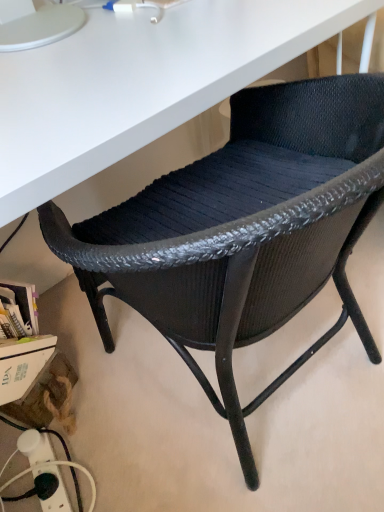
Where is `black woven chair at center`? black woven chair at center is located at coordinates (243, 231).

Describe the element at coordinates (243, 231) in the screenshot. The height and width of the screenshot is (512, 384). I see `black woven chair at center` at that location.

What do you see at coordinates (52, 490) in the screenshot? This screenshot has width=384, height=512. I see `black plastic power strip at lower left` at bounding box center [52, 490].

The image size is (384, 512). I want to click on black plastic power strip at lower left, so click(52, 490).

Find the location of a particular element. black woven chair at center is located at coordinates (243, 231).

Does black plastic power strip at lower left appear on the right side of black woven chair at center?

No.

Is black plastic power strip at lower left in front of or behind black woven chair at center in the image?

Visually, black plastic power strip at lower left is located behind black woven chair at center.

Which is in front, point (52, 506) or point (309, 155)?

Point (309, 155)

From the image's perspective, which one is positioned lower, black plastic power strip at lower left or black woven chair at center?

black plastic power strip at lower left.

From a real-world perspective, which is physically above, black plastic power strip at lower left or black woven chair at center?

black woven chair at center.

Which object is wider, black plastic power strip at lower left or black woven chair at center?

Wider between the two is black woven chair at center.

Considering the sizes of objects black plastic power strip at lower left and black woven chair at center in the image provided, who is shorter, black plastic power strip at lower left or black woven chair at center?

black plastic power strip at lower left is shorter.

Is black plastic power strip at lower left smaller than black woven chair at center?

Correct, black plastic power strip at lower left occupies less space than black woven chair at center.

Is black plastic power strip at lower left completely or partially outside of black woven chair at center?

Yes, black plastic power strip at lower left is outside of black woven chair at center.

Is black plastic power strip at lower left directly adjacent to black woven chair at center?

black plastic power strip at lower left is not next to black woven chair at center, and they're not touching.

Is black plastic power strip at lower left looking in the opposite direction of black woven chair at center?

No, black plastic power strip at lower left is not facing away from black woven chair at center.

You are a GUI agent. You are given a task and a screenshot of the screen. Output one action in this format:
    pyautogui.click(x=<x>, y=<y>)
    Task: Click on the chair that appears on the right of black plastic power strip at lower left
    
    Given the screenshot: What is the action you would take?
    pos(243,231)

Would you say black woven chair at center is to the left or to the right of black plastic power strip at lower left in the picture?

black woven chair at center is positioned on black plastic power strip at lower left's right side.

Between black woven chair at center and black plastic power strip at lower left, which one is positioned in front?

black woven chair at center is in front.

Considering the points (141, 206) and (44, 479), which point is behind, point (141, 206) or point (44, 479)?

The point (44, 479) is farther.

From the image's perspective, would you say black woven chair at center is positioned over black plastic power strip at lower left?

Indeed, from the image's perspective, black woven chair at center is shown above black plastic power strip at lower left.

From a real-world perspective, is black woven chair at center physically located above or below black plastic power strip at lower left?

From a real-world perspective, black woven chair at center is physically above black plastic power strip at lower left.

From the picture: Considering the sizes of objects black woven chair at center and black plastic power strip at lower left in the image provided, who is thinner, black woven chair at center or black plastic power strip at lower left?

black plastic power strip at lower left is thinner.

Does black woven chair at center have a lesser height compared to black plastic power strip at lower left?

No.

Considering the sizes of objects black woven chair at center and black plastic power strip at lower left in the image provided, who is smaller, black woven chair at center or black plastic power strip at lower left?

With smaller size is black plastic power strip at lower left.

Do you think black woven chair at center is within black plastic power strip at lower left, or outside of it?

black woven chair at center is not inside black plastic power strip at lower left, it's outside.

Is black woven chair at center in contact with black plastic power strip at lower left?

No.

Does black woven chair at center turn towards black plastic power strip at lower left?

No, black woven chair at center is not facing towards black plastic power strip at lower left.

How different are the orientations of black woven chair at center and black plastic power strip at lower left in degrees?

They differ by 102 degrees in their facing directions.

The height and width of the screenshot is (512, 384). What are the coordinates of `chair located above the black plastic power strip at lower left (from a real-world perspective)` in the screenshot? It's located at (243, 231).

Where is `chair in front of the black plastic power strip at lower left`? This screenshot has height=512, width=384. chair in front of the black plastic power strip at lower left is located at coordinates (243, 231).

At what (x,y) coordinates should I click in order to perform the action: click on electric outlet lying below the black woven chair at center (from the image's perspective). Please return your answer as a coordinate pair (x, y). Looking at the image, I should click on (52, 490).